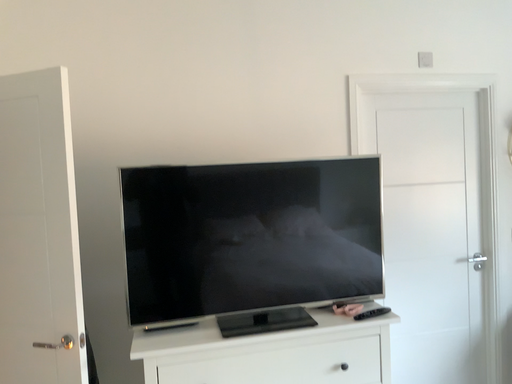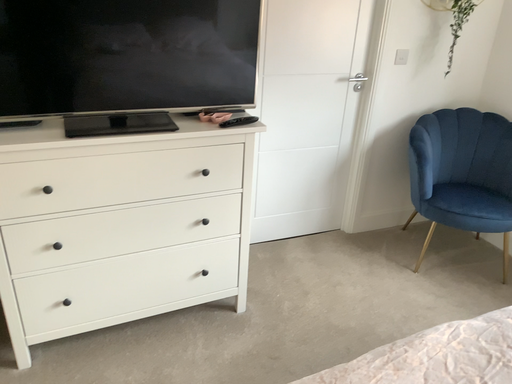
Question: Which way did the camera rotate in the video?

Choices:
 (A) rotated upward
 (B) rotated downward

Answer: (B)